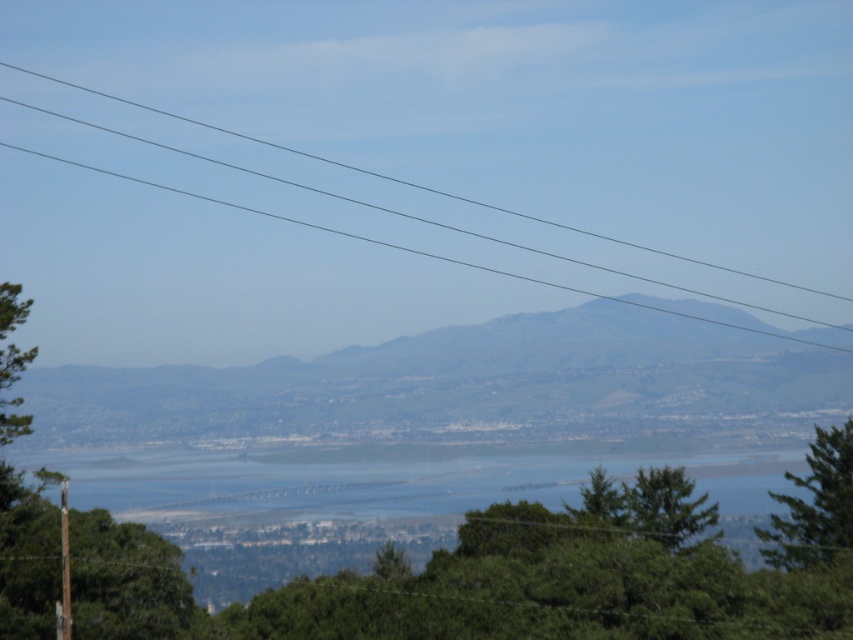
From the picture: Can you confirm if clear wire at upper center is taller than green matte tree at center?

Yes, clear wire at upper center is taller than green matte tree at center.

I want to click on clear wire at upper center, so click(415, 182).

Find the location of a particular element. clear wire at upper center is located at coordinates pyautogui.click(x=415, y=182).

Describe the element at coordinates (415, 182) in the screenshot. This screenshot has height=640, width=853. I see `clear wire at upper center` at that location.

Looking at this image, is clear wire at upper center positioned in front of green leafy tree at center?

No.

Which is in front, point (396, 179) or point (674, 476)?

Point (674, 476)

The image size is (853, 640). In order to click on clear wire at upper center in this screenshot , I will do `click(415, 182)`.

Between point (178, 406) and point (556, 257), which one is positioned in front?

Point (178, 406) is more forward.

Is point (293, 356) positioned after point (714, 296)?

No.

Identify the location of green grassy mountain at center. This screenshot has height=640, width=853. (453, 381).